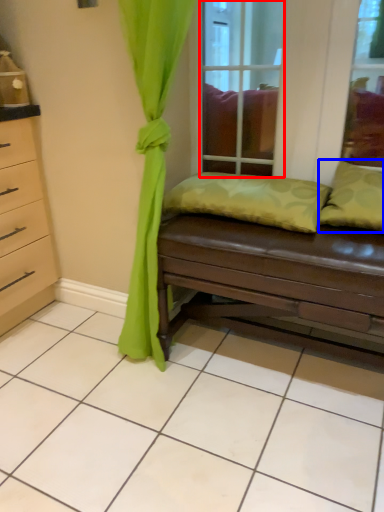
Question: Among these objects, which one is nearest to the camera, glass door (highlighted by a red box) or pillow (highlighted by a blue box)?

Choices:
 (A) glass door
 (B) pillow

Answer: (B)